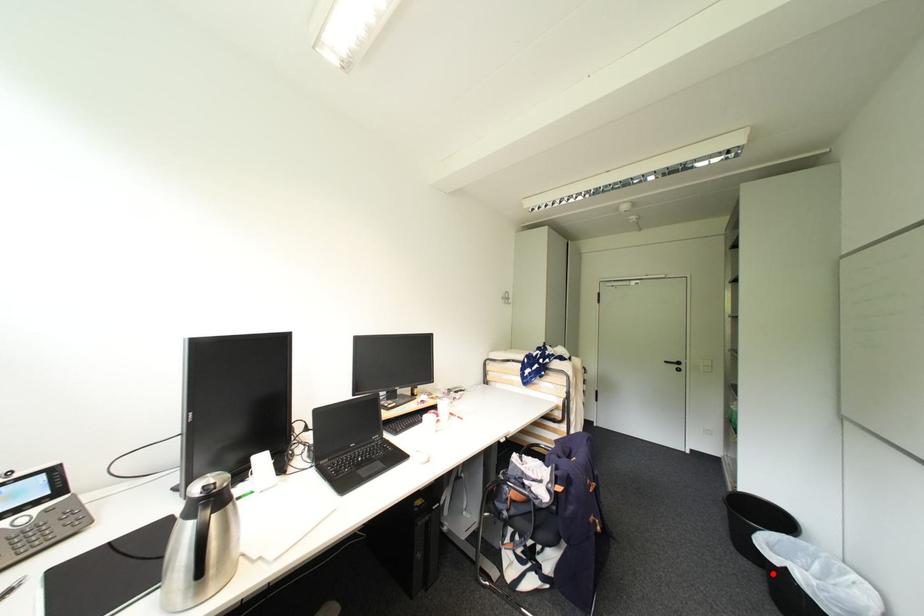
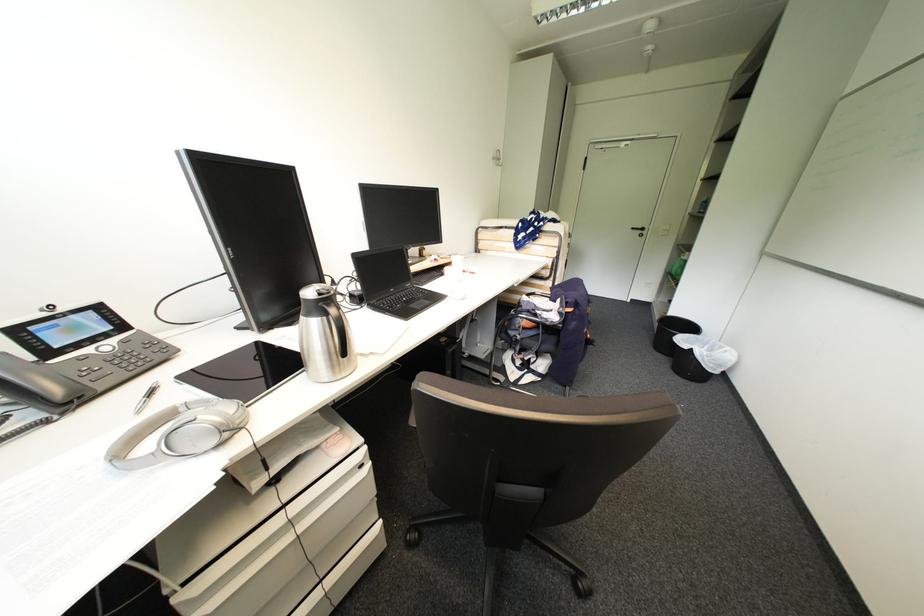
In the second image, find the point that corresponds to the highlighted location in the first image.

(677, 359)